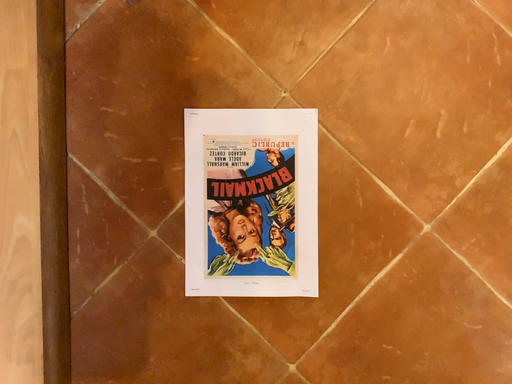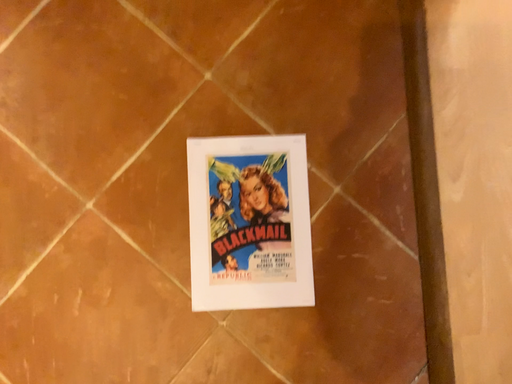
Question: Which way did the camera rotate in the video?

Choices:
 (A) rotated downward
 (B) rotated upward

Answer: (B)